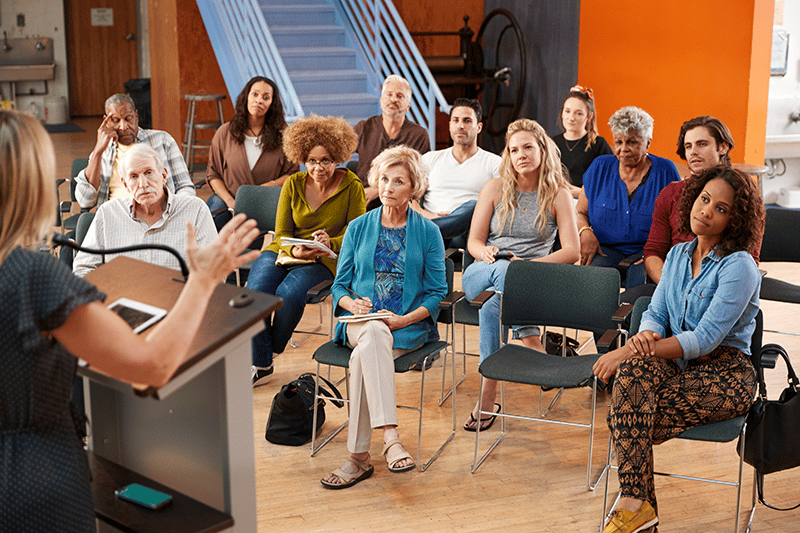
Locate an element on the screen. women sitting in chairs is located at coordinates (318, 176), (253, 150), (380, 224), (496, 189), (596, 185), (574, 145), (680, 298).